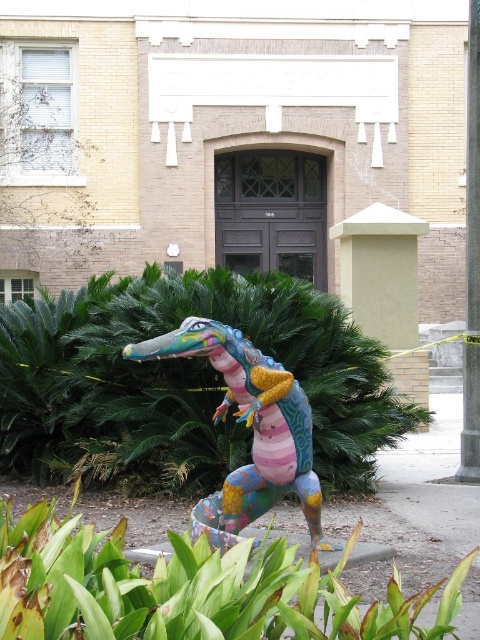
Based on the photo, is green leafy plant at lower center to the left of multicolored painted crocodile at center from the viewer's perspective?

Yes, green leafy plant at lower center is to the left of multicolored painted crocodile at center.

How far apart are green leafy plant at lower center and multicolored painted crocodile at center?

The distance of green leafy plant at lower center from multicolored painted crocodile at center is 3.72 feet.

Which is in front, point (417, 625) or point (237, 401)?

Positioned in front is point (417, 625).

Where is `green leafy plant at lower center`? The height and width of the screenshot is (640, 480). green leafy plant at lower center is located at coordinates (191, 588).

Measure the distance from green leafy plant at lower center to smooth gray pole at right.

green leafy plant at lower center and smooth gray pole at right are 5.22 meters apart.

Does green leafy plant at lower center have a smaller size compared to smooth gray pole at right?

Answer: Incorrect, green leafy plant at lower center is not smaller in size than smooth gray pole at right.

Locate an element on the screen. The image size is (480, 640). green leafy plant at lower center is located at coordinates (191, 588).

The width and height of the screenshot is (480, 640). Identify the location of green leafy plant at center. (182, 381).

Identify the location of green leafy plant at center. The width and height of the screenshot is (480, 640). (182, 381).